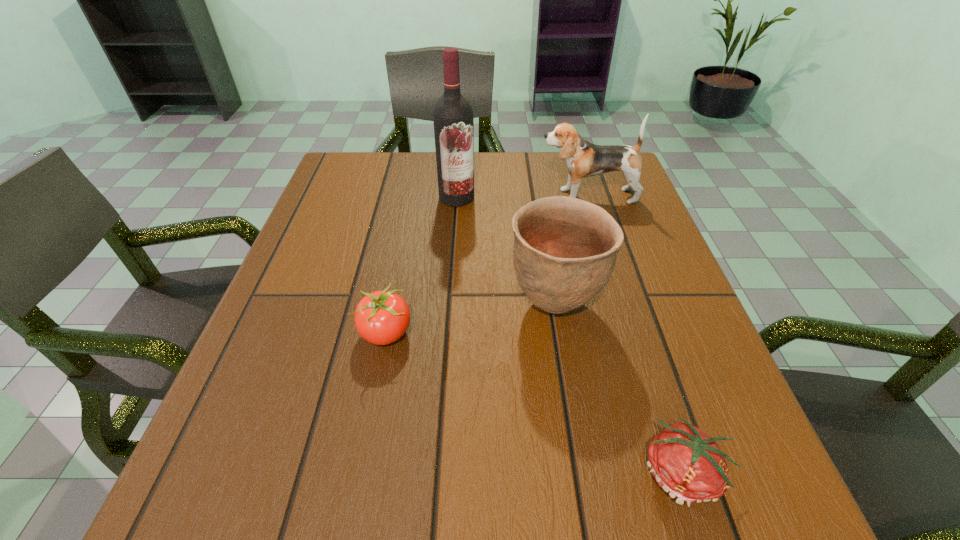
Locate an element on the screen. The width and height of the screenshot is (960, 540). wine bottle is located at coordinates (453, 118).

Identify the location of the fourth object from right to left. (453, 118).

In order to click on puppy in this screenshot , I will do `click(584, 159)`.

Image resolution: width=960 pixels, height=540 pixels. Find the location of `pottery`. pottery is located at coordinates (565, 249).

Locate an element on the screen. the leftmost object is located at coordinates (382, 317).

Identify the location of the left tomato. This screenshot has width=960, height=540. (382, 317).

Where is `the nearer tomato`? This screenshot has width=960, height=540. the nearer tomato is located at coordinates (686, 463).

Find the location of a particular element. This screenshot has height=540, width=960. the nearest object is located at coordinates pos(686,463).

This screenshot has width=960, height=540. I want to click on blank space located on the label of the tallest object, so click(x=452, y=271).

Where is `vacant region located 0.300m at the face of the puppy`? Image resolution: width=960 pixels, height=540 pixels. vacant region located 0.300m at the face of the puppy is located at coordinates (417, 196).